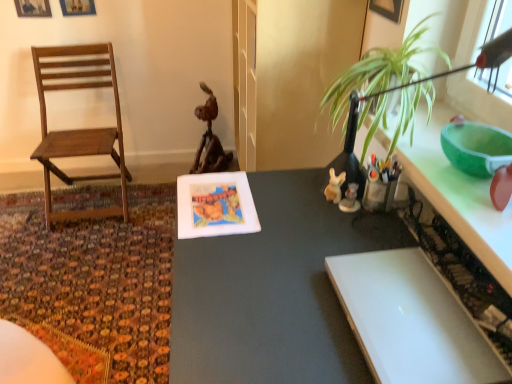
The width and height of the screenshot is (512, 384). I want to click on vacant area in front of white glossy figurine at center-right, the 1th toy from the right, so click(350, 238).